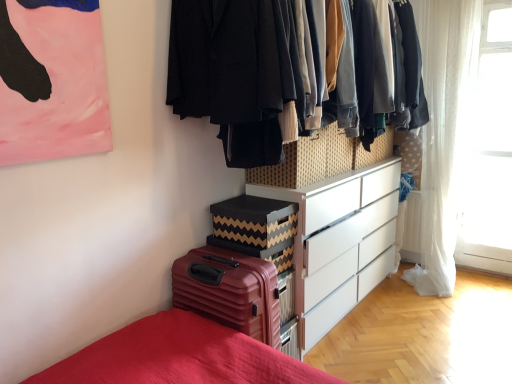
Identify the location of free space in front of white sheer curtain at right. (492, 284).